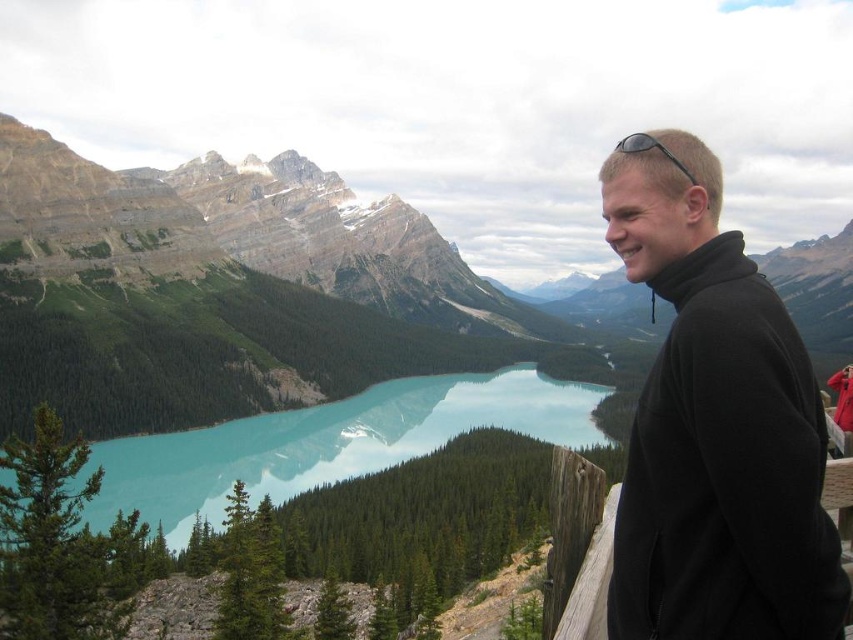
What do you see at coordinates (329, 442) in the screenshot? The height and width of the screenshot is (640, 853). I see `turquoise glossy water at center` at bounding box center [329, 442].

Is point (384, 412) positioned after point (635, 132)?

No, (384, 412) is closer to viewer.

In order to click on turquoise glossy water at center in this screenshot , I will do `click(329, 442)`.

Is black fleece jacket at right to the left of turquoise glossy water at center from the viewer's perspective?

No, black fleece jacket at right is not to the left of turquoise glossy water at center.

Which is behind, point (734, 403) or point (402, 436)?

Positioned behind is point (402, 436).

Does point (792, 499) come in front of point (386, 461)?

Yes, it is in front of point (386, 461).

This screenshot has height=640, width=853. Identify the location of black fleece jacket at right. (715, 428).

Who is more distant from viewer, (747, 259) or (662, 145)?

Point (662, 145)

Is black fleece jacket at right wider than black rubber sunglasses at upper right?

Incorrect, black fleece jacket at right's width does not surpass black rubber sunglasses at upper right's.

Which is in front, point (706, 211) or point (631, 141)?

Point (706, 211) is more forward.

Locate an element on the screen. This screenshot has height=640, width=853. black fleece jacket at right is located at coordinates (715, 428).